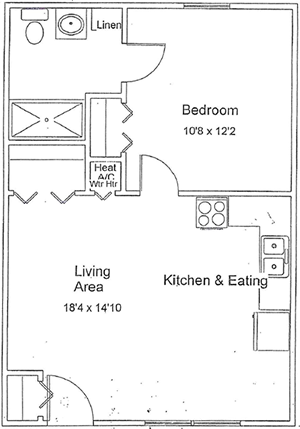
Locate an element on the screen. Image resolution: width=300 pixels, height=429 pixels. hvac is located at coordinates (101, 179).